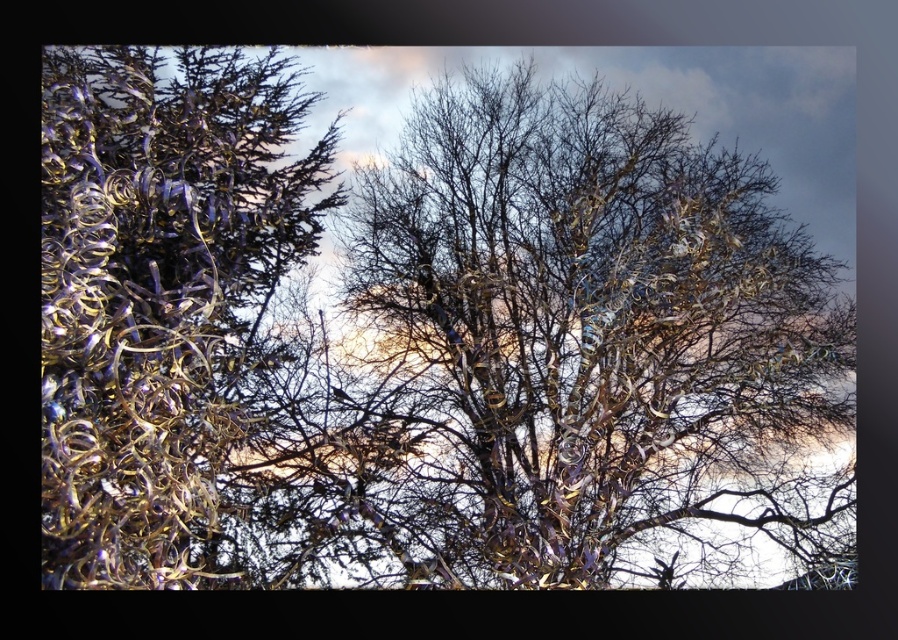
Question: Which point is closer to the camera?

Choices:
 (A) metallic gold tinsel at left
 (B) metallic gold tree at center

Answer: (A)

Question: Can you confirm if metallic gold tree at center is positioned above metallic gold tinsel at left?

Choices:
 (A) no
 (B) yes

Answer: (A)

Question: Which object is farther from the camera taking this photo?

Choices:
 (A) metallic gold tree at center
 (B) metallic gold tinsel at left

Answer: (A)

Question: Is the position of metallic gold tree at center less distant than that of metallic gold tinsel at left?

Choices:
 (A) yes
 (B) no

Answer: (B)

Question: Does metallic gold tree at center appear on the right side of metallic gold tinsel at left?

Choices:
 (A) yes
 (B) no

Answer: (A)